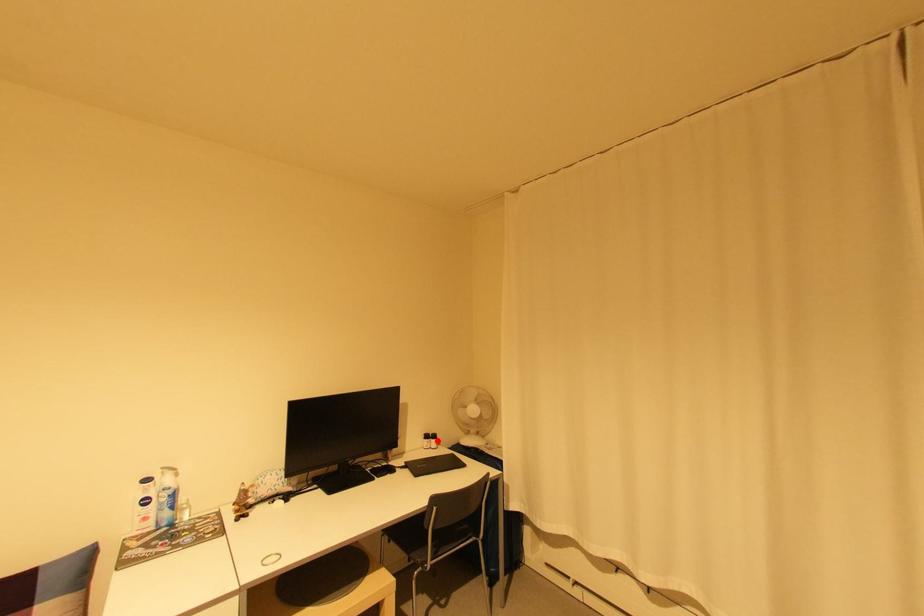
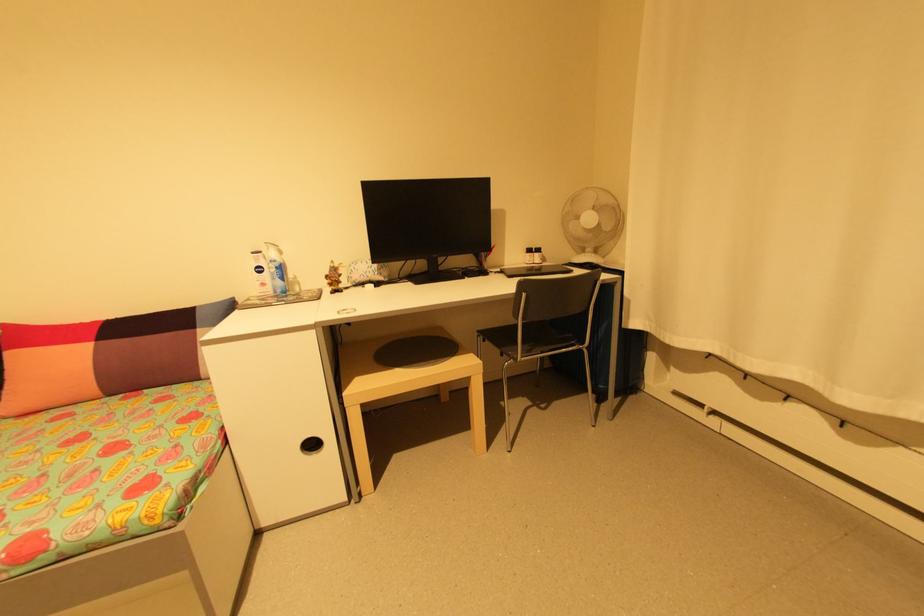
The point at the highlighted location is marked in the first image. Where is the corresponding point in the second image?

(541, 254)